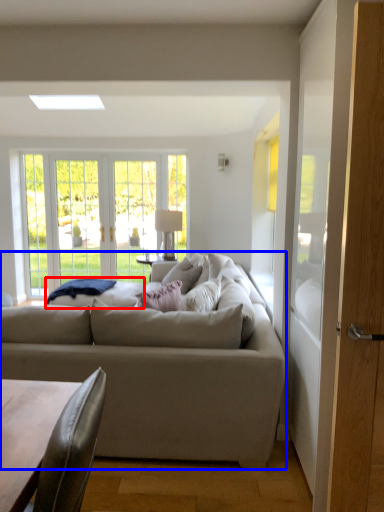
Question: Among these objects, which one is nearest to the camera, wide (highlighted by a red box) or studio couch (highlighted by a blue box)?

Choices:
 (A) wide
 (B) studio couch

Answer: (B)